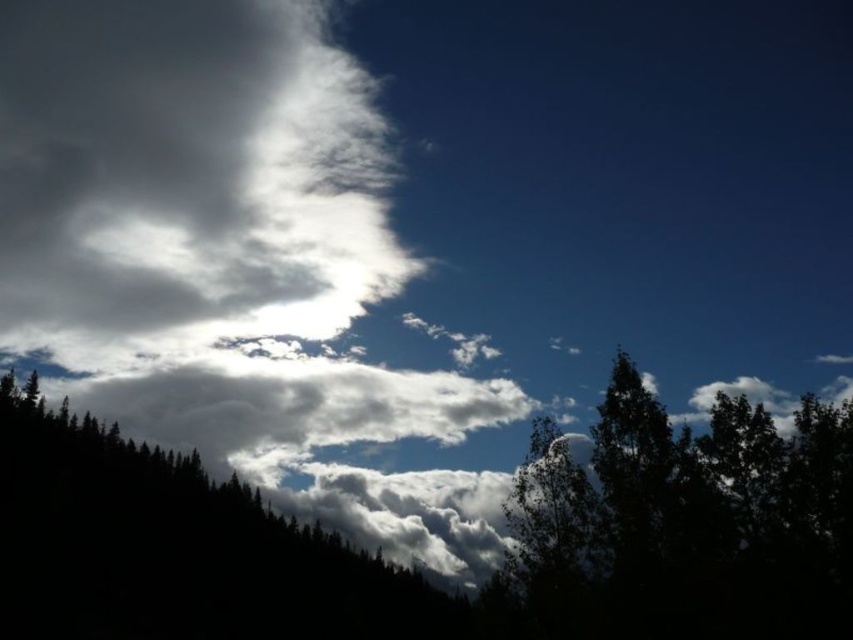
Is dark green foliage at lower center taller than white fluffy cloud at upper left?

No.

Can you confirm if dark green foliage at lower center is positioned to the right of white fluffy cloud at upper left?

Indeed, dark green foliage at lower center is positioned on the right side of white fluffy cloud at upper left.

Where is `dark green foliage at lower center`? The image size is (853, 640). dark green foliage at lower center is located at coordinates (421, 573).

The image size is (853, 640). I want to click on dark green foliage at lower center, so click(x=421, y=573).

Is white fluffy cloud at upper left above green leafy tree at center?

Yes, white fluffy cloud at upper left is above green leafy tree at center.

Who is more forward, (308, 252) or (817, 470)?

Point (817, 470) is more forward.

Find the location of a particular element. The width and height of the screenshot is (853, 640). white fluffy cloud at upper left is located at coordinates (184, 179).

Image resolution: width=853 pixels, height=640 pixels. I want to click on white fluffy cloud at upper left, so click(184, 179).

What are the coordinates of `dark green foliage at lower center` in the screenshot? It's located at (421, 573).

Does dark green foliage at lower center have a smaller size compared to green leafy tree at center?

Incorrect, dark green foliage at lower center is not smaller in size than green leafy tree at center.

Image resolution: width=853 pixels, height=640 pixels. What do you see at coordinates (421, 573) in the screenshot?
I see `dark green foliage at lower center` at bounding box center [421, 573].

Where is `dark green foliage at lower center`? The height and width of the screenshot is (640, 853). dark green foliage at lower center is located at coordinates (421, 573).